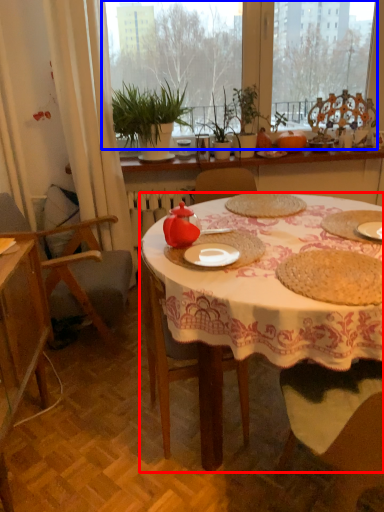
Question: Which of the following is the closest to the observer, desk (highlighted by a red box) or window screen (highlighted by a blue box)?

Choices:
 (A) desk
 (B) window screen

Answer: (A)